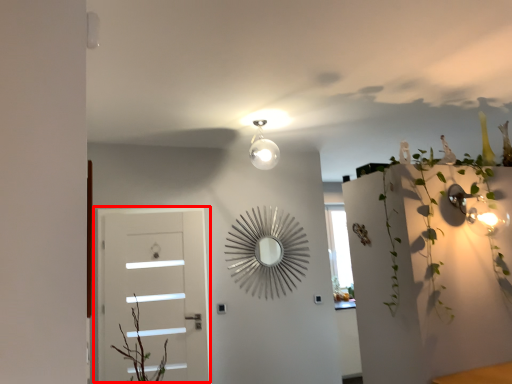
Question: From the image's perspective, considering the relative positions of door (annotated by the red box) and plant in the image provided, where is door (annotated by the red box) located with respect to the staircase?

Choices:
 (A) above
 (B) below

Answer: (B)